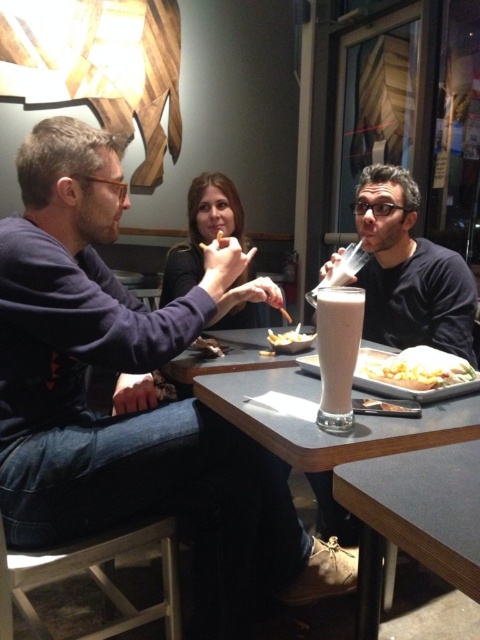
From the picture: You are sitting at the smooth gray table at lower right and want to pass a napkin to the person wearing the matte black shirt at center. Which direction should you move the napkin to reach them?

The smooth gray table at lower right is to the right of the matte black shirt at center, so you should move the napkin to the left to reach them.

You are a waiter in this cozy restaurant and need to place a new order of golden crispy fries at center and a shiny silver spoon at lower center on the table. Based on the scene description, which item is positioned higher on the table?

The golden crispy fries at center is taller than the shiny silver spoon at lower center, so the golden crispy fries at center is positioned higher on the table.